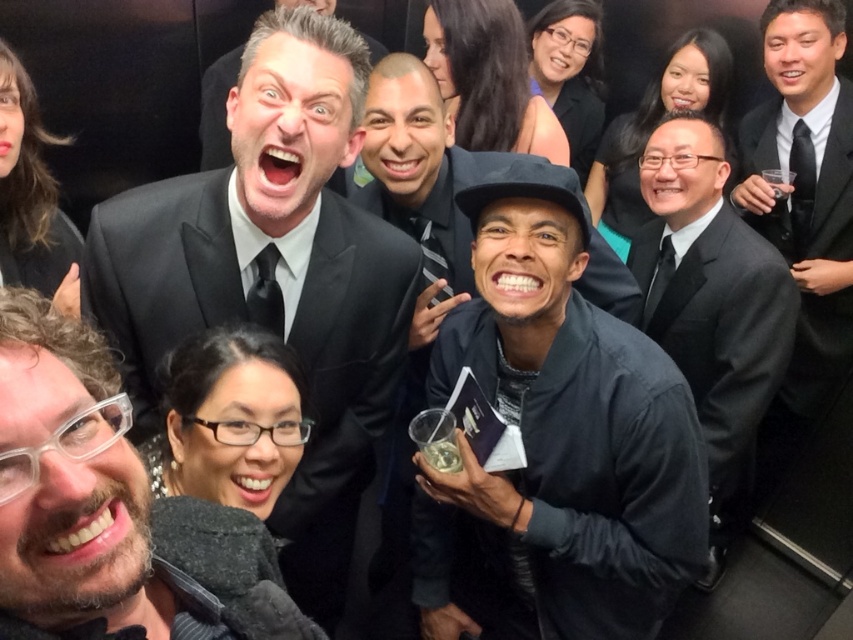
Question: Among these points, which one is nearest to the camera?

Choices:
 (A) (376, 51)
 (B) (332, 17)

Answer: (B)

Question: Considering the real-world distances, which object is closest to the matte black suit at upper center?

Choices:
 (A) dark blue fabric jacket at center
 (B) black satin suit at right

Answer: (A)

Question: Does matte black suit at upper center appear on the left side of dark brown hair at left?

Choices:
 (A) yes
 (B) no

Answer: (B)

Question: Which point is closer to the camera?

Choices:
 (A) (619, 368)
 (B) (35, 252)
 (C) (318, 132)

Answer: (C)

Question: Does black matte hat at center have a lesser width compared to smooth black hair at upper center?

Choices:
 (A) no
 (B) yes

Answer: (B)

Question: Does dark blue fabric jacket at center have a larger size compared to matte black suit at upper center?

Choices:
 (A) yes
 (B) no

Answer: (B)